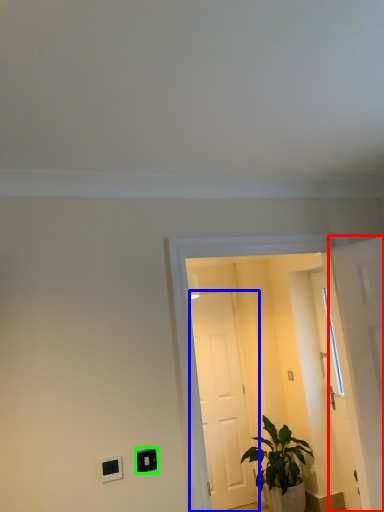
Question: Estimate the real-world distances between objects in this image. Which object is farther from door (highlighted by a red box), door (highlighted by a blue box) or light switch (highlighted by a green box)?

Choices:
 (A) door
 (B) light switch

Answer: (A)